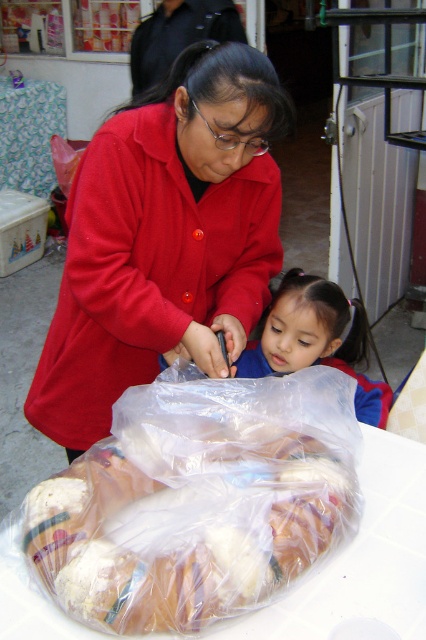
Where is the matte red coat at center located in the image?

The matte red coat at center is located at point 0.373 on the x axis and 0.387 on the y axis.

You are standing in front of the translucent plastic bag at center. If you want to reach into the bag without moving your feet, will your arm need to extend more than 70 centimeters?

The distance between the translucent plastic bag at center and the camera is 70.59 centimeters. Since you are standing in front of it, your arm would need to extend approximately that distance to reach the bag. Therefore, yes, your arm would need to extend more than 70 centimeters to reach the translucent plastic bag at center.

You are standing at the point labeled point (x=40, y=545) and want to walk to the point labeled point (x=333, y=300). Which direction should you face to move towards your destination?

You should face backward because point (x=40, y=545) is in front of point (x=333, y=300), so moving backward would take you toward the latter point.